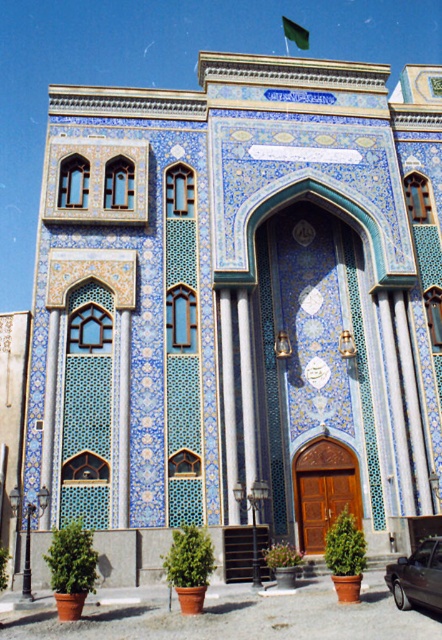
Describe the element at coordinates (418, 577) in the screenshot. I see `metallic gray car at lower right` at that location.

Between point (403, 596) and point (304, 42), which one is positioned behind?

Point (304, 42)

Identify the location of metallic gray car at lower right. This screenshot has height=640, width=442. (418, 577).